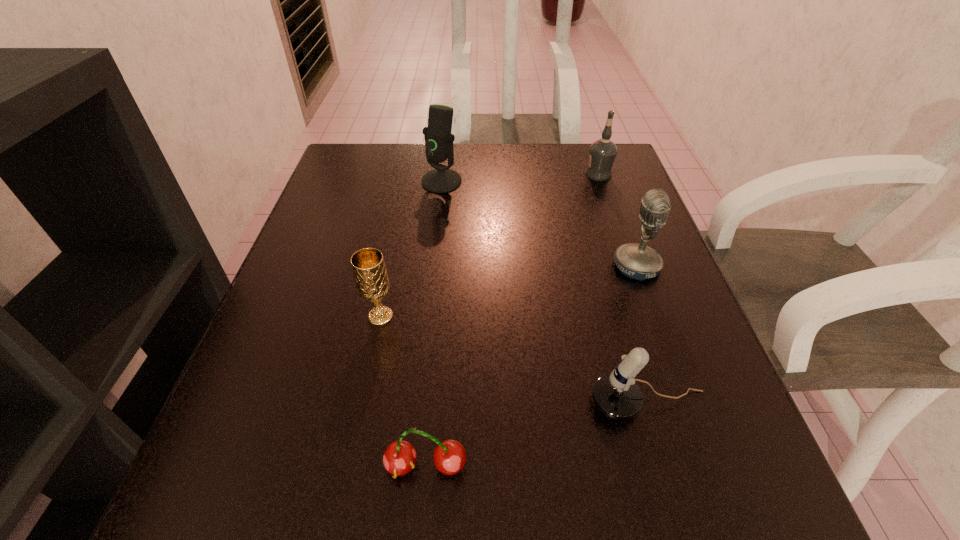
At what (x,y) coordinates should I click in order to perform the action: click on vacant area that lies between the third farthest object and the third nearest object. Please return your answer as a coordinate pair (x, y). The height and width of the screenshot is (540, 960). Looking at the image, I should click on (509, 291).

Where is `vacant point located between the farthest microphone and the vodka`? Image resolution: width=960 pixels, height=540 pixels. vacant point located between the farthest microphone and the vodka is located at coordinates (520, 178).

Image resolution: width=960 pixels, height=540 pixels. Identify the location of free space between the leftmost microphone and the third nearest object. (411, 249).

Where is `vacant area between the shortest microphone and the fourth nearest object`? The height and width of the screenshot is (540, 960). vacant area between the shortest microphone and the fourth nearest object is located at coordinates (642, 335).

Locate an element on the screen. Image resolution: width=960 pixels, height=540 pixels. free space between the vodka and the shortest microphone is located at coordinates (624, 289).

Image resolution: width=960 pixels, height=540 pixels. Find the location of `vacant area between the fifth farthest object and the cherry`. vacant area between the fifth farthest object and the cherry is located at coordinates (538, 435).

Where is `free spot between the leftmost object and the fourth nearest object`? free spot between the leftmost object and the fourth nearest object is located at coordinates (509, 291).

The width and height of the screenshot is (960, 540). Find the location of `vacant space that is in between the fourth nearest object and the farthest microphone`. vacant space that is in between the fourth nearest object and the farthest microphone is located at coordinates (540, 224).

Locate an element on the screen. This screenshot has height=540, width=960. free space between the leftmost microphone and the shortest object is located at coordinates (434, 323).

The image size is (960, 540). I want to click on free space between the third farthest object and the second nearest object, so click(642, 335).